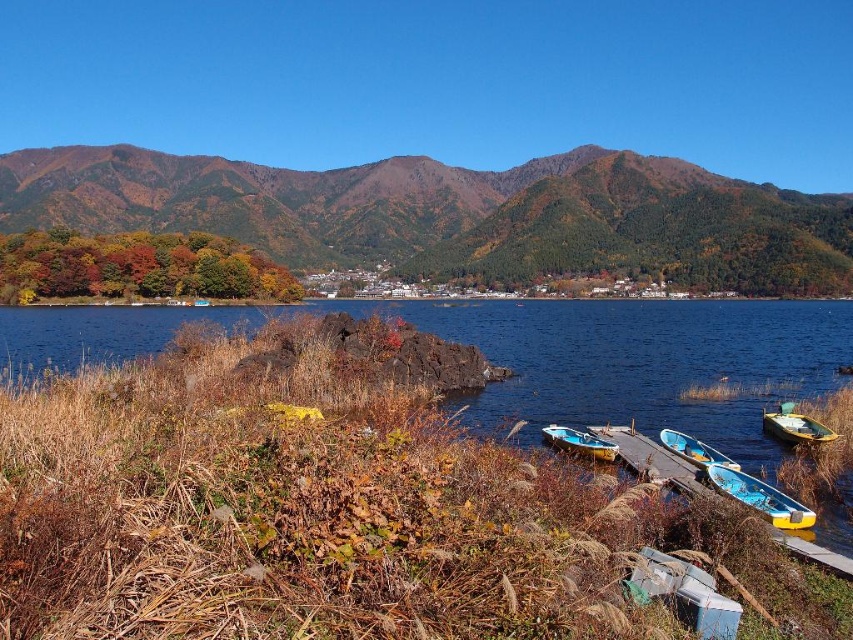
Question: Which object is farther from the camera taking this photo?

Choices:
 (A) blue painted wooden canoe at lower center
 (B) blue water at lower center
 (C) autumn foliage mountain at upper center

Answer: (C)

Question: Observing the image, what is the correct spatial positioning of blue glossy canoe at lower right in reference to blue wooden boat at lower center?

Choices:
 (A) left
 (B) right

Answer: (B)

Question: Which is nearer to the wooden boat at lower right?

Choices:
 (A) blue wooden boat at lower center
 (B) autumn foliage mountain at upper center
 (C) blue water at lower center
 (D) blue glossy canoe at lower right

Answer: (A)

Question: Does autumn foliage mountain at upper center come in front of blue water at lower center?

Choices:
 (A) no
 (B) yes

Answer: (A)

Question: Does autumn foliage mountain at upper center have a smaller size compared to blue wooden boat at lower center?

Choices:
 (A) no
 (B) yes

Answer: (A)

Question: Among these objects, which one is farthest from the camera?

Choices:
 (A) blue wooden boat at lower center
 (B) wooden boat at lower right

Answer: (B)